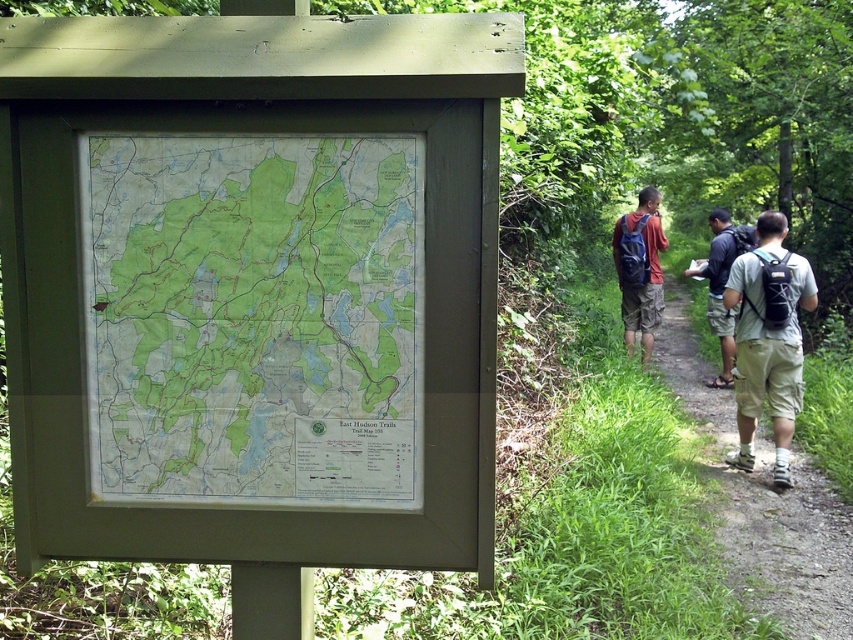
You are standing at the wooden signboard in the East Hudson Trails area. You see a brown dirt path at center and khaki cotton shorts at right. Which object is located to the right of the other?

The khaki cotton shorts at right are located to the right of the brown dirt path at center.

You are a hiker trying to read the green paper map at center while standing on the brown dirt path at center. Considering their heights, which one is shorter?

The green paper map at center is shorter than the brown dirt path at center.